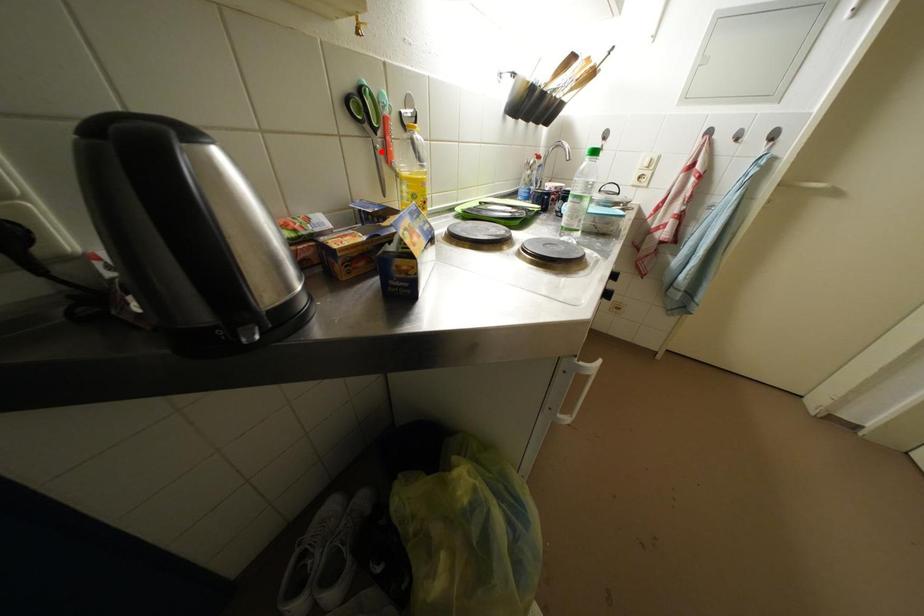
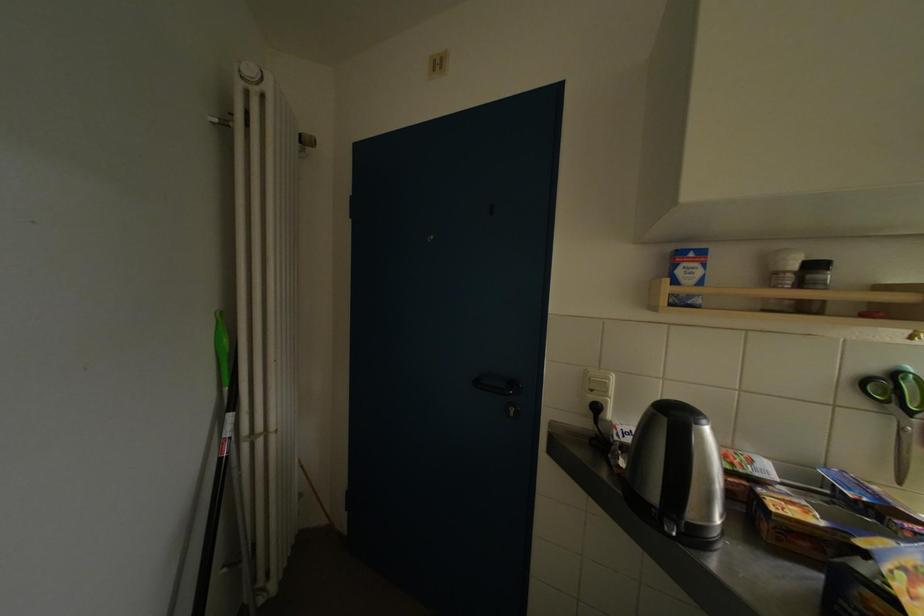
Find the pixel in the second image that matches the highlighted location in the first image.

(908, 434)